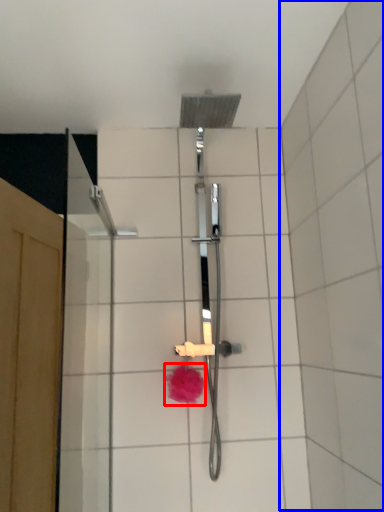
Question: Which point is further to the camera, flower (highlighted by a red box) or ceramic tile (highlighted by a blue box)?

Choices:
 (A) flower
 (B) ceramic tile

Answer: (A)